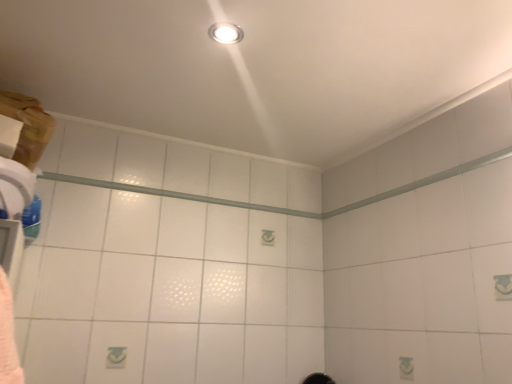
Question: Does matte silver light fixture at upper center have a greater height compared to clear glass beam at upper center?

Choices:
 (A) yes
 (B) no

Answer: (B)

Question: Does matte silver light fixture at upper center have a larger size compared to clear glass beam at upper center?

Choices:
 (A) yes
 (B) no

Answer: (B)

Question: From the image's perspective, would you say matte silver light fixture at upper center is positioned over clear glass beam at upper center?

Choices:
 (A) yes
 (B) no

Answer: (A)

Question: Are matte silver light fixture at upper center and clear glass beam at upper center far apart?

Choices:
 (A) no
 (B) yes

Answer: (A)

Question: Considering the relative positions of matte silver light fixture at upper center and clear glass beam at upper center in the image provided, is matte silver light fixture at upper center to the right of clear glass beam at upper center from the viewer's perspective?

Choices:
 (A) no
 (B) yes

Answer: (B)

Question: Is matte silver light fixture at upper center not within clear glass beam at upper center?

Choices:
 (A) yes
 (B) no

Answer: (A)

Question: From the image's perspective, is clear glass beam at upper center under matte silver light fixture at upper center?

Choices:
 (A) yes
 (B) no

Answer: (A)

Question: Could you tell me if clear glass beam at upper center is turned towards matte silver light fixture at upper center?

Choices:
 (A) yes
 (B) no

Answer: (B)

Question: From a real-world perspective, is clear glass beam at upper center on top of matte silver light fixture at upper center?

Choices:
 (A) no
 (B) yes

Answer: (A)

Question: From the image's perspective, is clear glass beam at upper center located above matte silver light fixture at upper center?

Choices:
 (A) yes
 (B) no

Answer: (B)

Question: Is clear glass beam at upper center touching matte silver light fixture at upper center?

Choices:
 (A) no
 (B) yes

Answer: (A)

Question: Considering the relative sizes of clear glass beam at upper center and matte silver light fixture at upper center in the image provided, is clear glass beam at upper center shorter than matte silver light fixture at upper center?

Choices:
 (A) yes
 (B) no

Answer: (B)

Question: From a real-world perspective, relative to clear glass beam at upper center, is matte silver light fixture at upper center vertically above or below?

Choices:
 (A) below
 (B) above

Answer: (B)